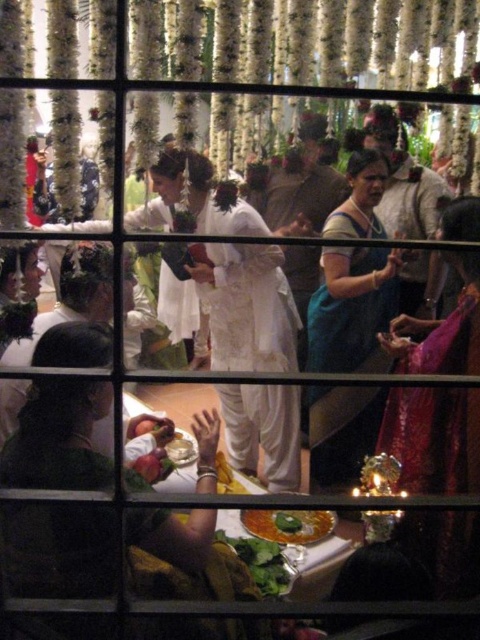
Question: Is shiny golden plate at lower center above green leafy vegetable at lower center?

Choices:
 (A) no
 (B) yes

Answer: (B)

Question: Where is green leafy vegetable at lower center located in relation to white glossy bowl at center in the image?

Choices:
 (A) left
 (B) right

Answer: (B)

Question: Which object is farther from the camera taking this photo?

Choices:
 (A) white glossy bowl at center
 (B) green leafy vegetable at lower center
 (C) shiny golden plate at lower center
 (D) teal silk saree at center

Answer: (D)

Question: Can you confirm if silky pink saree at right is smaller than white glossy bowl at center?

Choices:
 (A) yes
 (B) no

Answer: (B)

Question: Estimate the real-world distances between objects in this image. Which object is farther from the silky pink saree at right?

Choices:
 (A) green leafy vegetable at lower center
 (B) white glossy bowl at center

Answer: (B)

Question: Considering the real-world distances, which object is farthest from the white glossy bowl at center?

Choices:
 (A) teal silk saree at center
 (B) green leafy vegetable at lower center
 (C) shiny golden plate at lower center
 (D) silky pink saree at right

Answer: (A)